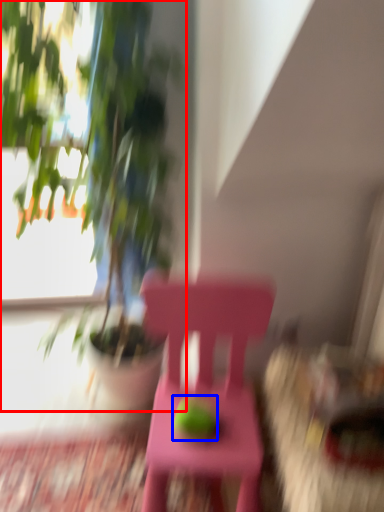
Question: Among these objects, which one is farthest to the camera, houseplant (highlighted by a red box) or fruit (highlighted by a blue box)?

Choices:
 (A) houseplant
 (B) fruit

Answer: (B)